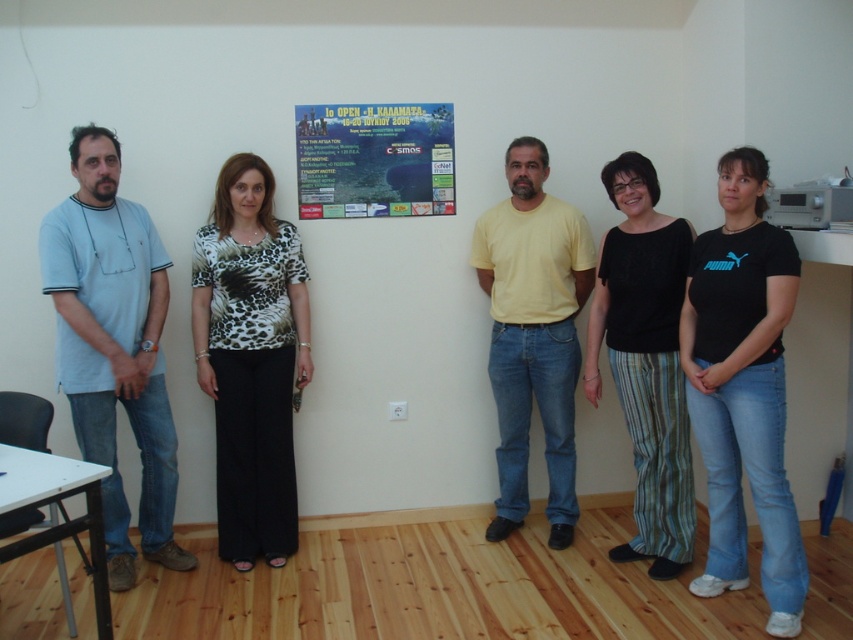
Question: Is black textured pants at center further to camera compared to blue glossy poster at center?

Choices:
 (A) no
 (B) yes

Answer: (A)

Question: Which object is positioned closest to the yellow cotton t-shirt at center?

Choices:
 (A) black textured pants at center
 (B) light blue cotton shirt at left

Answer: (A)

Question: Which object is positioned closest to the black textured pants at center?

Choices:
 (A) leopard print blouse at center
 (B) light blue cotton shirt at left
 (C) yellow cotton t-shirt at center

Answer: (C)

Question: Is light blue cotton shirt at left bigger than leopard print blouse at center?

Choices:
 (A) no
 (B) yes

Answer: (B)

Question: Is leopard print blouse at center to the left of black textured pants at center from the viewer's perspective?

Choices:
 (A) no
 (B) yes

Answer: (B)

Question: Among these objects, which one is farthest from the camera?

Choices:
 (A) leopard print blouse at center
 (B) blue glossy poster at center
 (C) yellow cotton t-shirt at center
 (D) black textured pants at center

Answer: (B)